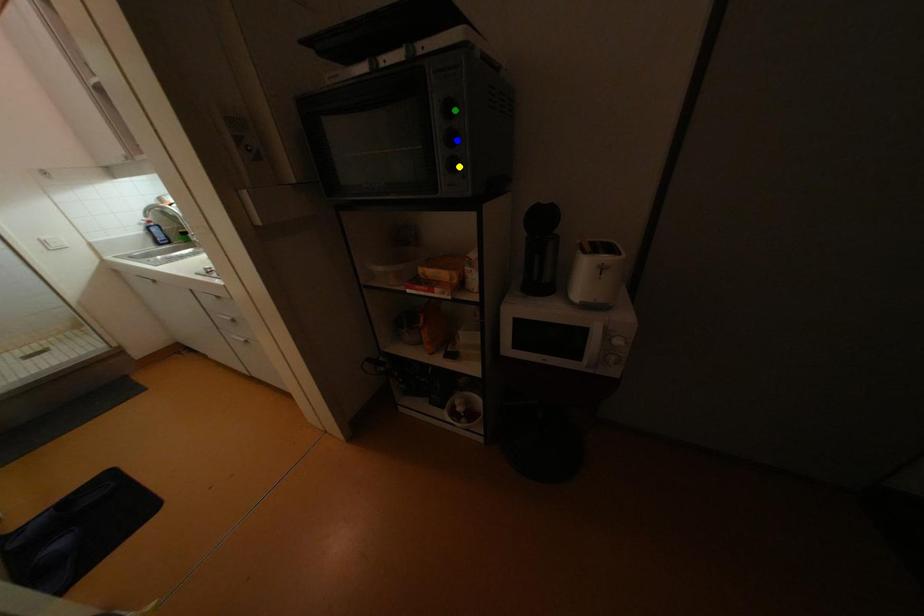
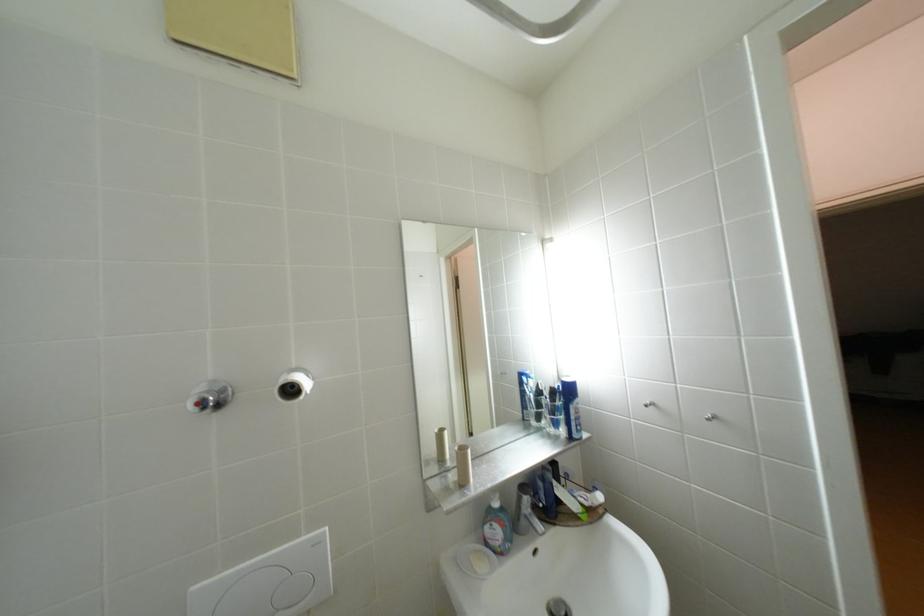
I am providing you with two images of the same scene from different viewpoints. Three points are marked in image1. Which point corresponds to a part or object that is occluded in image2?In image1, three points are marked. Which of them correspond to a part or object that is occluded in image2?Among the three points shown in image1, which one corresponds to a part or object that is no longer visible due to occlusion in image2?

green point, blue point, yellow point